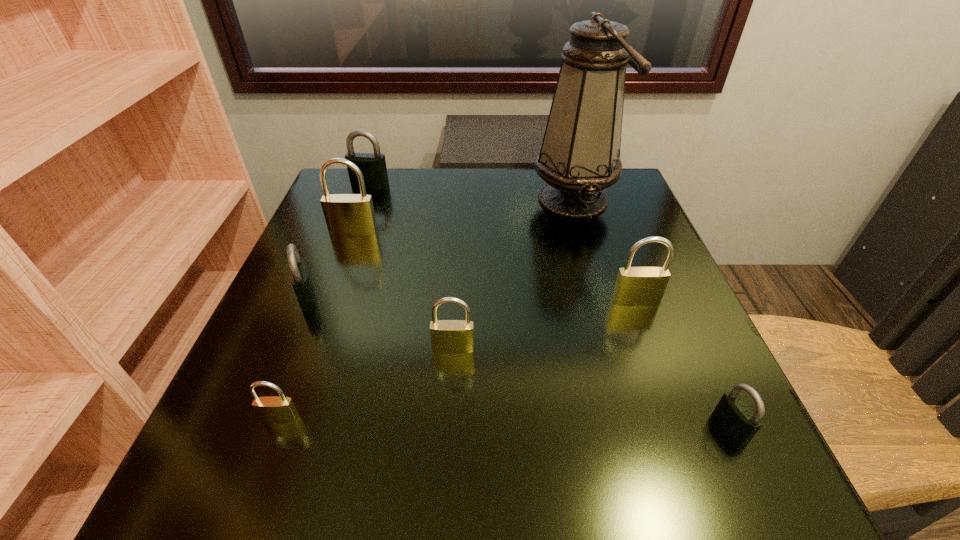
Locate an element on the screen. The image size is (960, 540). vacant space that is in between the rightmost object and the second biggest brass padlock is located at coordinates (683, 364).

The image size is (960, 540). What are the coordinates of `free area in between the smallest brass padlock and the second biggest brass padlock` in the screenshot? It's located at (458, 360).

Locate an element on the screen. empty space that is in between the second tallest object and the nearest black padlock is located at coordinates (541, 329).

Locate an element on the screen. free spot between the nearest black padlock and the second farthest brass padlock is located at coordinates (683, 364).

Locate which object ranks sixth in proximity to the brown oil lamp. Please provide its 2D coordinates. Your answer should be formatted as a tuple, i.e. [(x, y)], where the tuple contains the x and y coordinates of a point satisfying the conditions above.

[(300, 279)]

Identify which object is the nearest to the tallest padlock. Please provide its 2D coordinates. Your answer should be formatted as a tuple, i.e. [(x, y)], where the tuple contains the x and y coordinates of a point satisfying the conditions above.

[(300, 279)]

Identify the location of padlock that is the fourth closest to the rightmost black padlock. Image resolution: width=960 pixels, height=540 pixels. click(x=300, y=279).

Locate which padlock is the second closest to the second padlock from right to left. Please provide its 2D coordinates. Your answer should be formatted as a tuple, i.e. [(x, y)], where the tuple contains the x and y coordinates of a point satisfying the conditions above.

[(447, 336)]

Find the location of a particular element. This screenshot has height=540, width=960. brass padlock that is the closest to the nearest brass padlock is located at coordinates (447, 336).

Where is `brass padlock that can be found as the third closest to the biggest brass padlock`? This screenshot has height=540, width=960. brass padlock that can be found as the third closest to the biggest brass padlock is located at coordinates (635, 286).